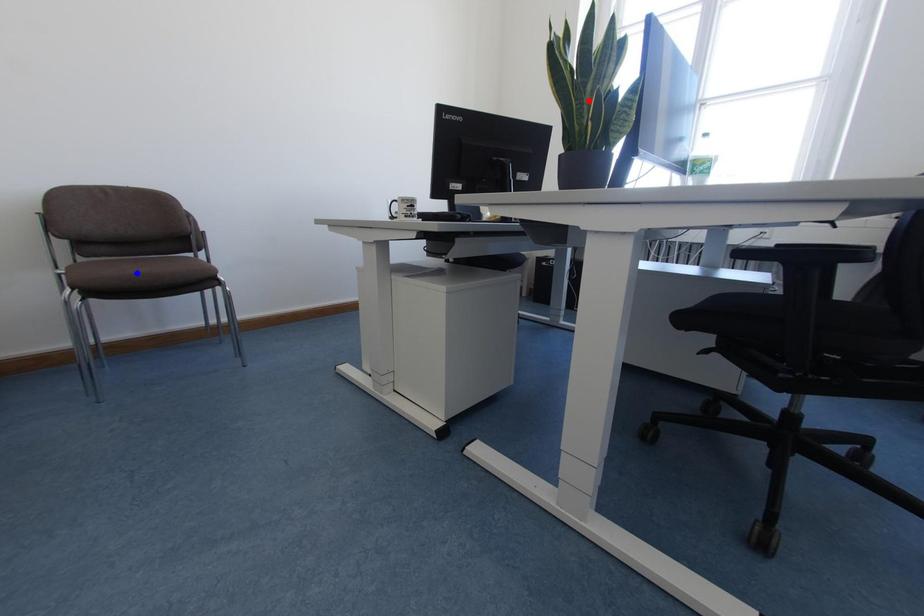
Question: Two points are marked on the image. Which point is closer to the camera?

Choices:
 (A) Blue point is closer.
 (B) Red point is closer.

Answer: (B)